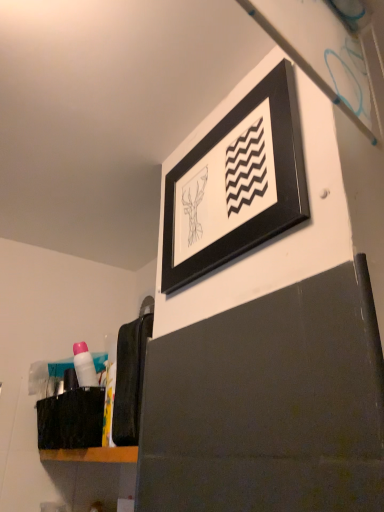
Where is `black matte picture frame at upper center`? The image size is (384, 512). black matte picture frame at upper center is located at coordinates (236, 183).

From a real-world perspective, which object stands above the other?

In real-world perspective, pink plastic tube at lower left is above.

Looking at their sizes, would you say pink plastic tube at lower left is wider or thinner than black fabric laundry at lower left?

In the image, pink plastic tube at lower left appears to be more narrow than black fabric laundry at lower left.

Are pink plastic tube at lower left and black fabric laundry at lower left located far from each other?

No, there isn't a large distance between pink plastic tube at lower left and black fabric laundry at lower left.

Locate an element on the screen. The image size is (384, 512). toiletry located below the black fabric laundry at lower left (from the image's perspective) is located at coordinates (84, 365).

Considering the positions of point (191, 158) and point (131, 362), is point (191, 158) closer or farther from the camera than point (131, 362)?

Point (191, 158) is farther from the camera than point (131, 362).

Are black matte picture frame at upper center and black fabric laundry at lower left beside each other?

No, black matte picture frame at upper center is not next to black fabric laundry at lower left.

Considering the relative sizes of black matte picture frame at upper center and black fabric laundry at lower left in the image provided, is black matte picture frame at upper center thinner than black fabric laundry at lower left?

Correct, the width of black matte picture frame at upper center is less than that of black fabric laundry at lower left.

From a real-world perspective, is black fabric laundry at lower left on black matte picture frame at upper center?

No.

Is black fabric laundry at lower left facing towards black matte picture frame at upper center?

No, black fabric laundry at lower left is not facing towards black matte picture frame at upper center.

Which is further, (132, 351) or (290, 108)?

Point (132, 351)

Can black matte picture frame at upper center be found inside black fabric laundry at lower left?

Actually, black matte picture frame at upper center is outside black fabric laundry at lower left.

Is black fabric laundry at lower left completely or partially outside of pink plastic tube at lower left?

Yes, black fabric laundry at lower left is not within pink plastic tube at lower left.

This screenshot has width=384, height=512. Find the location of `laundry above the pink plastic tube at lower left (from the image's perspective)`. laundry above the pink plastic tube at lower left (from the image's perspective) is located at coordinates 131,375.

From the image's perspective, between black fabric laundry at lower left and pink plastic tube at lower left, which one is located above?

black fabric laundry at lower left, from the image's perspective.

Is black fabric laundry at lower left oriented away from pink plastic tube at lower left?

No, black fabric laundry at lower left's orientation is not away from pink plastic tube at lower left.

From a real-world perspective, is black matte picture frame at upper center beneath pink plastic tube at lower left?

No, from a real-world perspective, black matte picture frame at upper center is not below pink plastic tube at lower left.

Is black matte picture frame at upper center touching pink plastic tube at lower left?

No.

Which is nearer, [249,200] or [93,369]?

Positioned in front is point [249,200].

This screenshot has width=384, height=512. I want to click on toiletry below the black matte picture frame at upper center (from the image's perspective), so click(84, 365).

In the scene shown: Considering the sizes of pink plastic tube at lower left and black matte picture frame at upper center in the image, is pink plastic tube at lower left taller or shorter than black matte picture frame at upper center?

Considering their sizes, pink plastic tube at lower left has less height than black matte picture frame at upper center.

Does pink plastic tube at lower left have a lesser width compared to black matte picture frame at upper center?

Incorrect, the width of pink plastic tube at lower left is not less than that of black matte picture frame at upper center.

Is pink plastic tube at lower left to the right of black matte picture frame at upper center from the viewer's perspective?

Incorrect, pink plastic tube at lower left is not on the right side of black matte picture frame at upper center.

From the image's perspective, is pink plastic tube at lower left located above or below black matte picture frame at upper center?

Based on their image positions, pink plastic tube at lower left is located beneath black matte picture frame at upper center.

I want to click on laundry that is under the pink plastic tube at lower left (from a real-world perspective), so click(131, 375).

The height and width of the screenshot is (512, 384). In order to click on laundry below the black matte picture frame at upper center (from the image's perspective) in this screenshot , I will do `click(131, 375)`.

From the picture: Estimate the real-world distances between objects in this image. Which object is closer to pink plastic tube at lower left, black fabric laundry at lower left or black matte picture frame at upper center?

The object closer to pink plastic tube at lower left is black fabric laundry at lower left.

Looking at the image, which one is located closer to black fabric laundry at lower left, black matte picture frame at upper center or pink plastic tube at lower left?

pink plastic tube at lower left is closer to black fabric laundry at lower left.

Which object lies further to the anchor point black matte picture frame at upper center, pink plastic tube at lower left or black fabric laundry at lower left?

pink plastic tube at lower left is further to black matte picture frame at upper center.

Estimate the real-world distances between objects in this image. Which object is further from pink plastic tube at lower left, black matte picture frame at upper center or black fabric laundry at lower left?

Among the two, black matte picture frame at upper center is located further to pink plastic tube at lower left.

Which object lies nearer to the anchor point black fabric laundry at lower left, pink plastic tube at lower left or black matte picture frame at upper center?

pink plastic tube at lower left lies closer to black fabric laundry at lower left than the other object.

From the image, which object appears to be farther from black matte picture frame at upper center, black fabric laundry at lower left or pink plastic tube at lower left?

pink plastic tube at lower left is positioned further to the anchor black matte picture frame at upper center.

Identify the location of laundry between black matte picture frame at upper center and pink plastic tube at lower left vertically. The width and height of the screenshot is (384, 512). (131, 375).